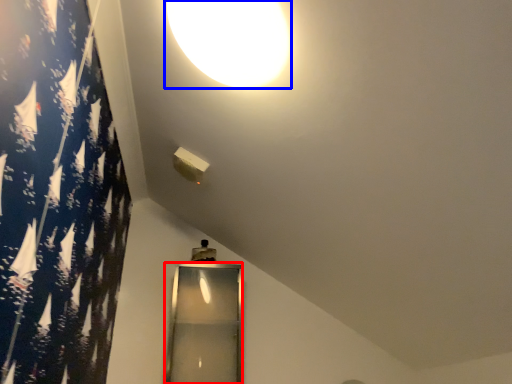
Question: Which of the following is the closest to the observer, glass door (highlighted by a red box) or lamp (highlighted by a blue box)?

Choices:
 (A) glass door
 (B) lamp

Answer: (B)